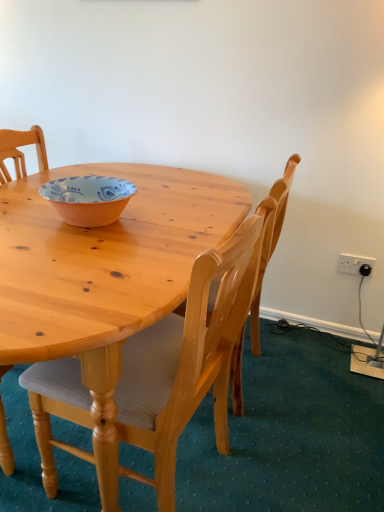
Locate an element on the screen. The width and height of the screenshot is (384, 512). free space to the right of light wood chair at center, the 2th chair from the back is located at coordinates (297, 452).